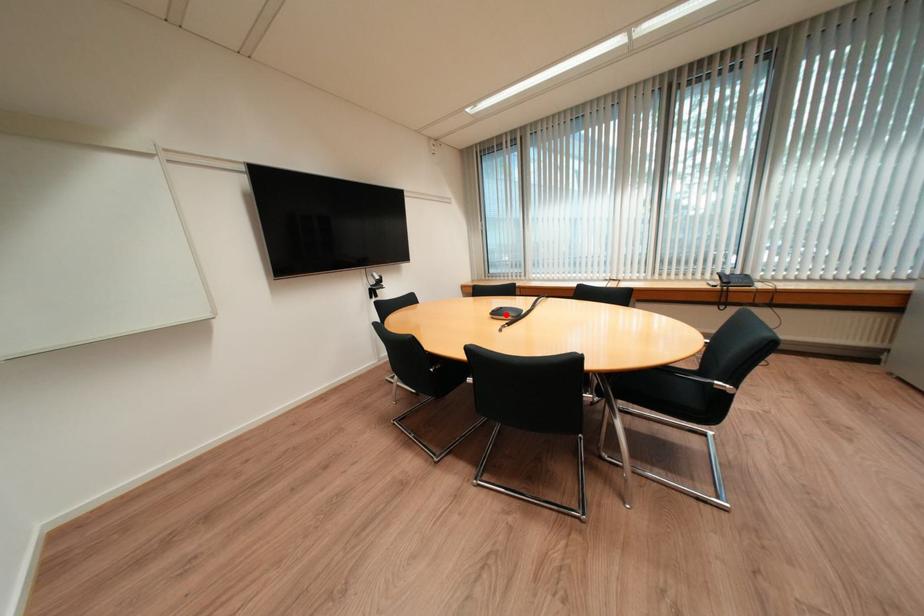
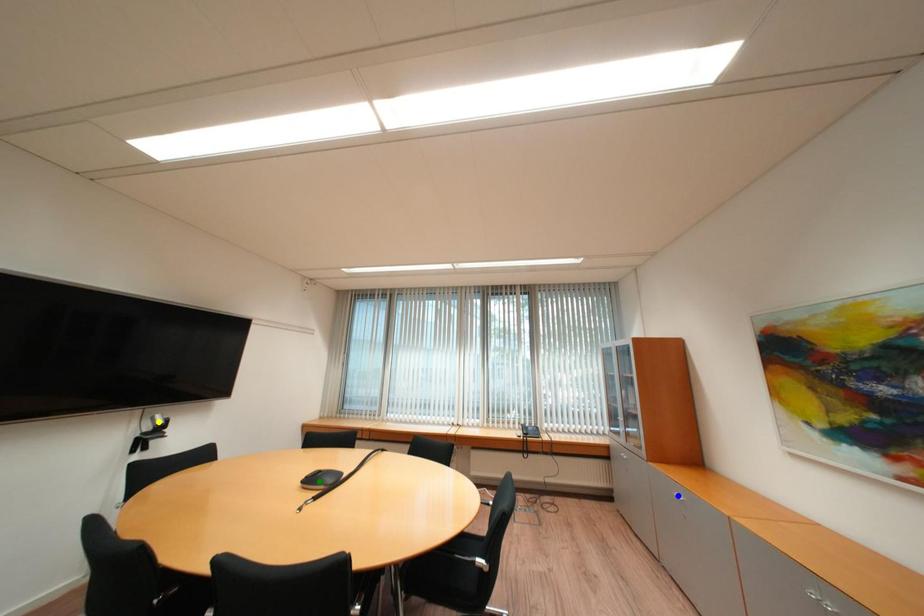
Question: I am providing you with two images of the same scene from different viewpoints. A red point is marked on the first image. You are given multiple points on the second image. Which point in image 2 is actually the same real-world point as the red point in image 1?

Choices:
 (A) blue point
 (B) green point
 (C) yellow point

Answer: (B)